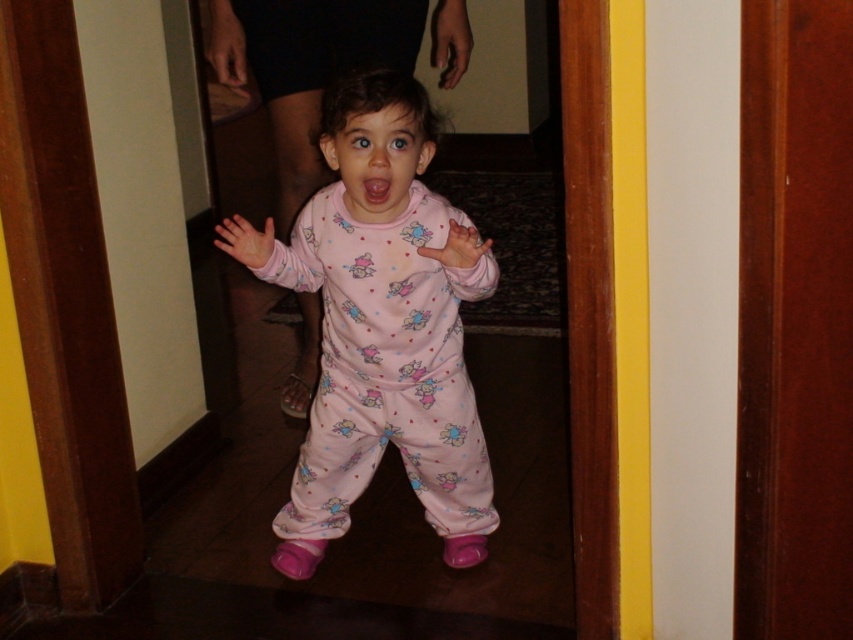
You are a robot trying to navigate through the doorway where the child is standing. You need to pass between the two points marked as point [369,388] and point [364,202]. Which point should you approach first to ensure safe passage?

Point [364,202] should be approached first because point [369,388] is behind it, so moving towards the closer point first ensures safe passage.

From the picture: You are a parent trying to ensure your child can safely pass through a doorway. Given the image, will the pink cotton pajamas at center be able to fit through the wooden door at center without any issues?

The pink cotton pajamas at center is taller than the wooden door at center, so the child wearing the pink cotton pajamas at center may not fit through the wooden door at center without bending or adjusting their posture.

You are a photographer trying to capture the child in the doorway. Since the pink cotton pajamas at center and the wooden door at center are both in the frame, which one should you focus on to ensure the subject is clear and in focus?

The pink cotton pajamas at center is larger in size than the wooden door at center, so focusing on the pink cotton pajamas at center would ensure the subject is clear and in focus.